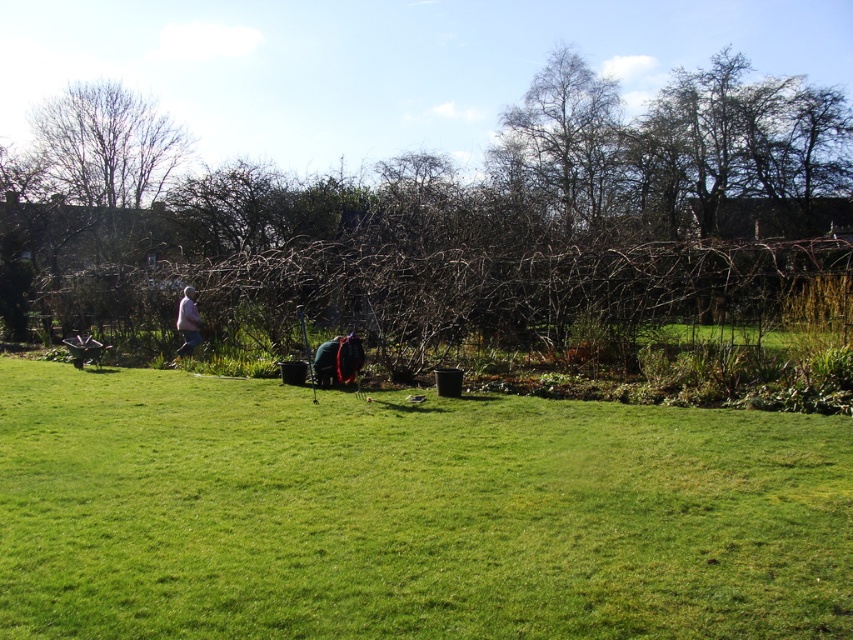
Is green grassy at center below brown leafless tree at center?

Correct, green grassy at center is located below brown leafless tree at center.

Who is more forward, (625, 480) or (701, 166)?

Point (625, 480) is in front.

Find the location of `green grassy at center`. green grassy at center is located at coordinates (409, 513).

Find the location of a particular element. green grassy at center is located at coordinates (409, 513).

Can you confirm if brown leafless tree at center is positioned to the left of bare branches at upper center?

Correct, you'll find brown leafless tree at center to the left of bare branches at upper center.

Between brown leafless tree at center and bare branches at upper center, which one has less height?

bare branches at upper center is shorter.

Is point (747, 115) closer to camera compared to point (604, 150)?

Yes, point (747, 115) is closer to viewer.

Where is `brown leafless tree at center`? This screenshot has width=853, height=640. brown leafless tree at center is located at coordinates (450, 216).

Who is higher up, green grassy at center or bare branches at upper center?

bare branches at upper center is above.

Between point (508, 541) and point (595, 157), which one is positioned behind?

The point (595, 157) is more distant.

Which is in front, point (76, 449) or point (547, 160)?

Point (76, 449)

Where is `green grassy at center`? The image size is (853, 640). green grassy at center is located at coordinates (409, 513).